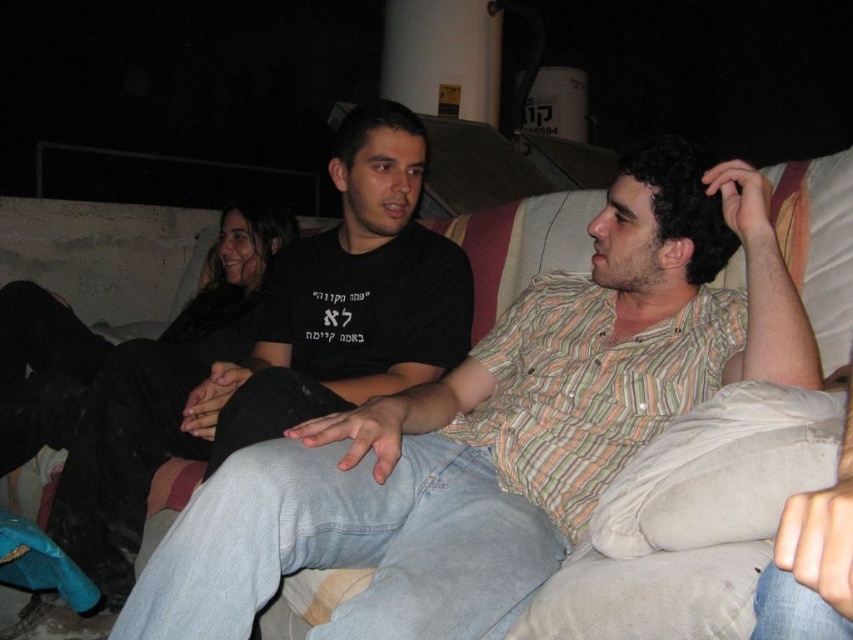
You are a tailor measuring the distance between two shirts on a couch in a dimly lit room. The striped cotton shirt at center and the black cotton shirt at center are placed on the couch. Can you fit a 16 inch wide tailor box between them?

The distance between the striped cotton shirt at center and the black cotton shirt at center is 18.07 inches, so yes, the 16 inch wide tailor box can fit between them since the space is wider than the box.

You are a fashion designer looking at the image. You see a striped cotton shirt at center and a black cotton shirt at center. Which one is positioned lower on the person?

The striped cotton shirt at center is below the black cotton shirt at center, so the striped cotton shirt at center is positioned lower.

Consider the image. You are trying to decide which shirt to wear for an event. Both the striped cotton shirt at center and the black cotton shirt at center are on the couch. If you want the taller shirt, which one should you choose?

The striped cotton shirt at center is not as tall as black cotton shirt at center, so you should choose the black cotton shirt at center because it is taller.